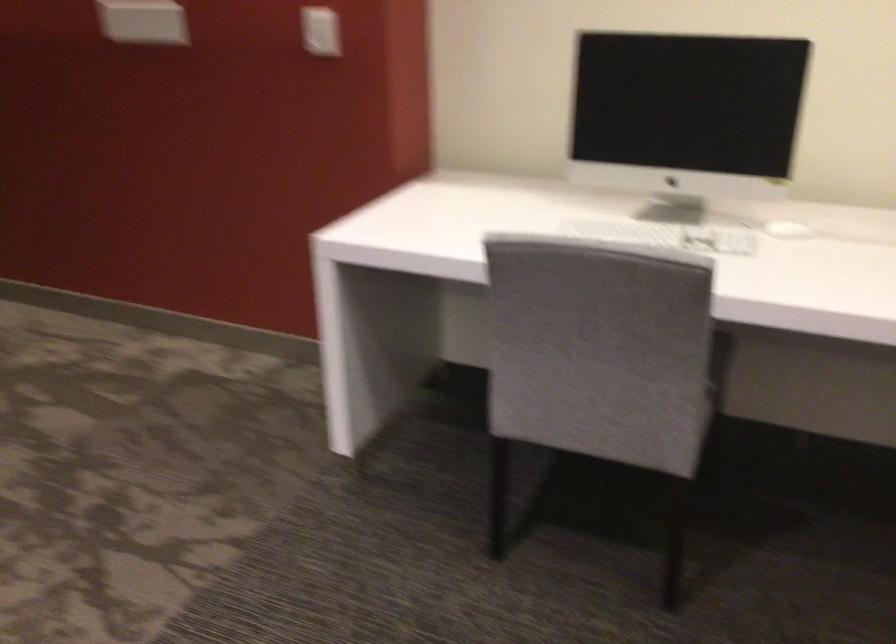
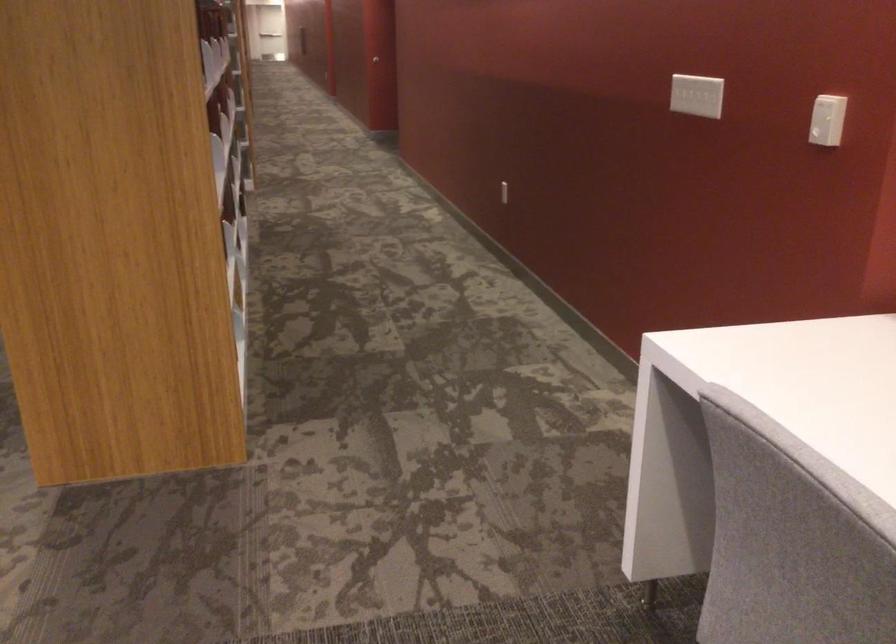
Question: How did the camera likely rotate?

Choices:
 (A) Left
 (B) Right
 (C) Up
 (D) Down

Answer: (A)